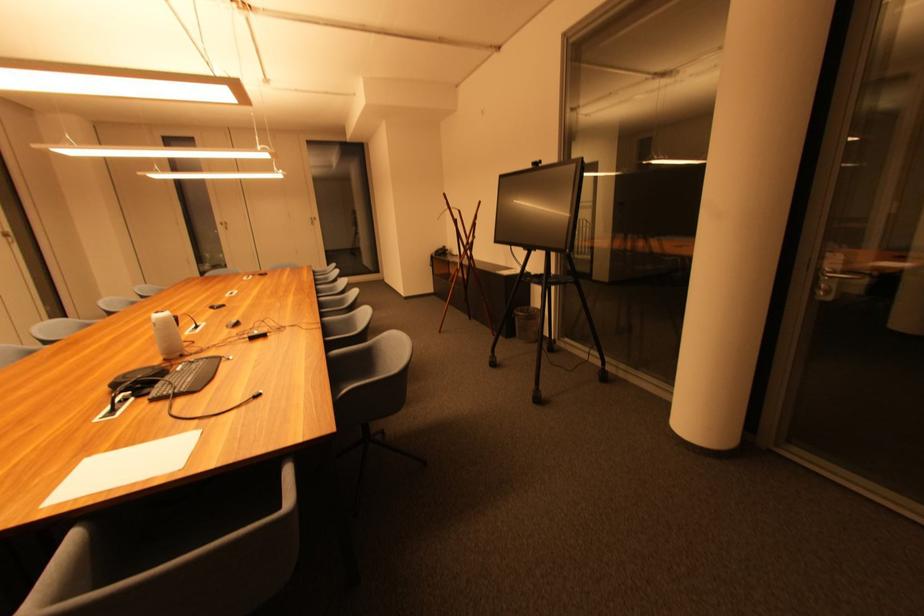
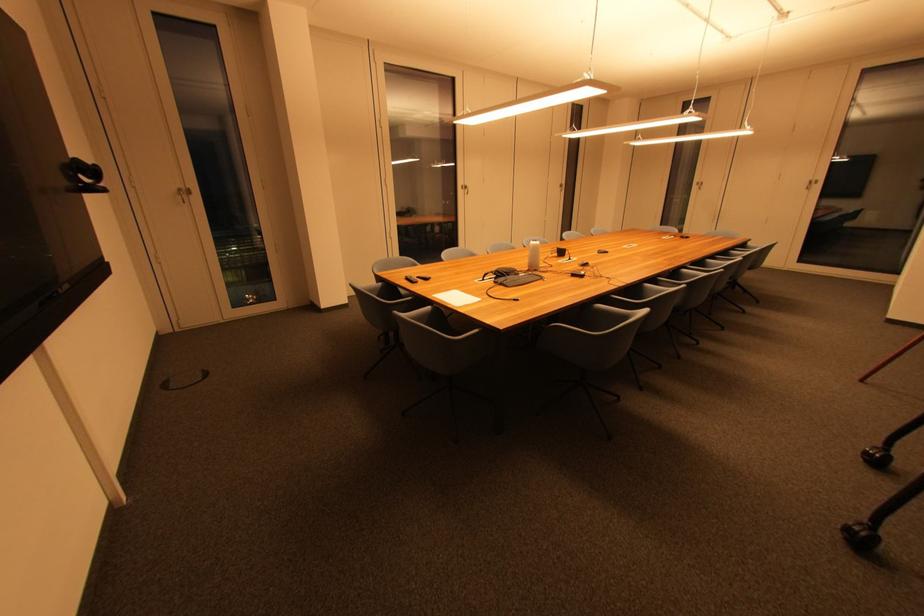
The point at [258,339] is marked in the first image. Where is the corresponding point in the second image?

(578, 277)